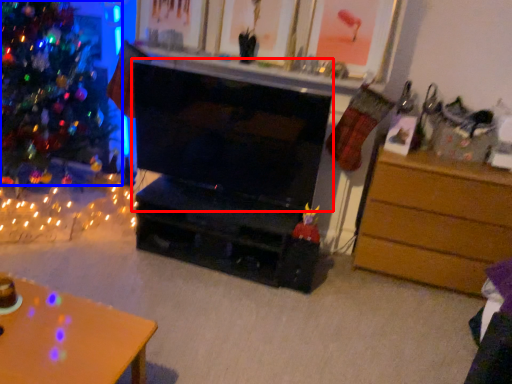
Question: Which object is closer to the camera taking this photo, fireplace (highlighted by a red box) or christmas tree (highlighted by a blue box)?

Choices:
 (A) fireplace
 (B) christmas tree

Answer: (B)